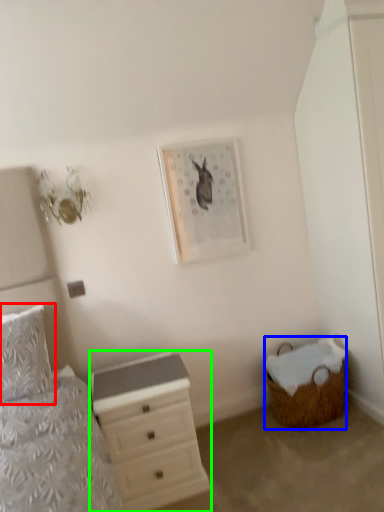
Question: Estimate the real-world distances between objects in this image. Which object is farther from pillow (highlighted by a red box), basket (highlighted by a blue box) or chest of drawers (highlighted by a green box)?

Choices:
 (A) basket
 (B) chest of drawers

Answer: (A)